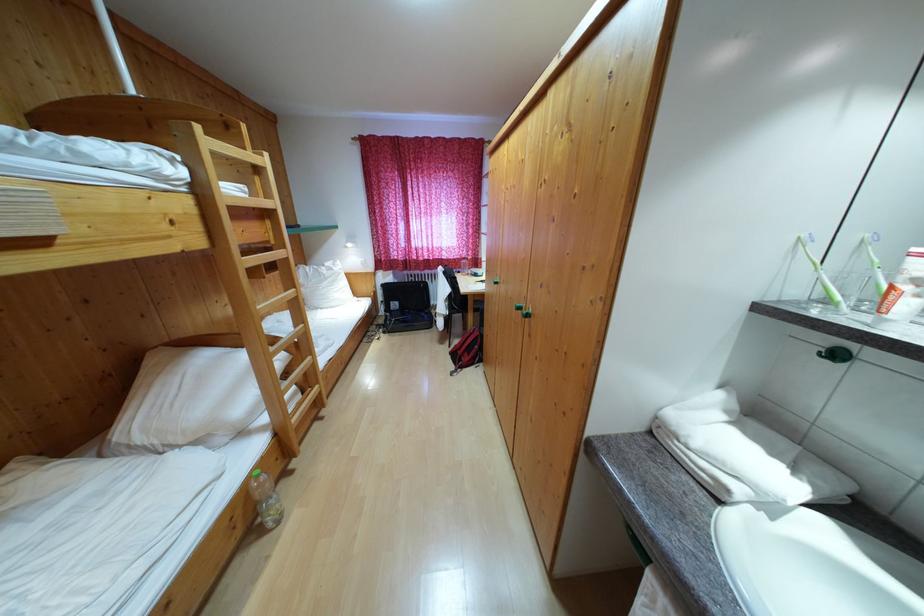
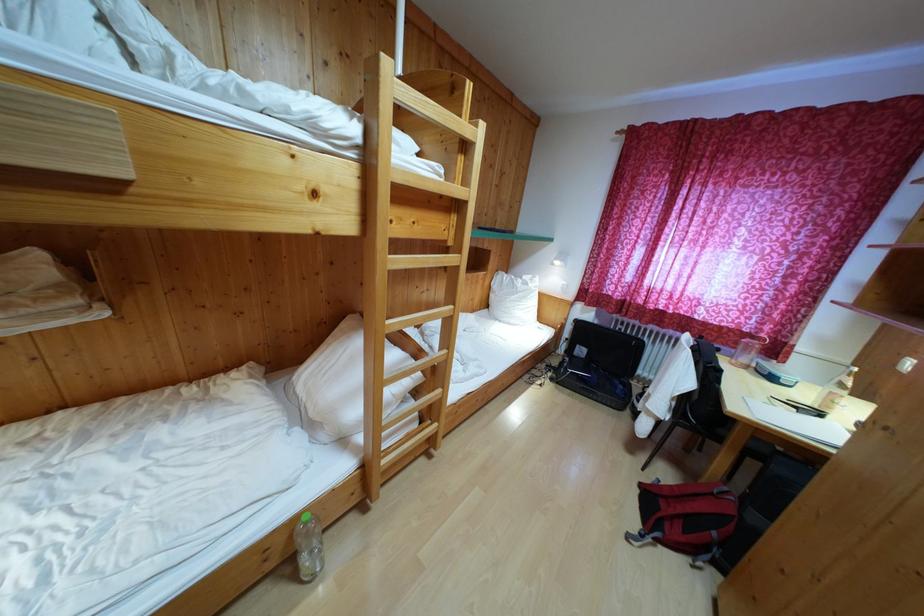
Question: How did the camera likely rotate?

Choices:
 (A) Left
 (B) Right
 (C) Up
 (D) Down

Answer: (A)